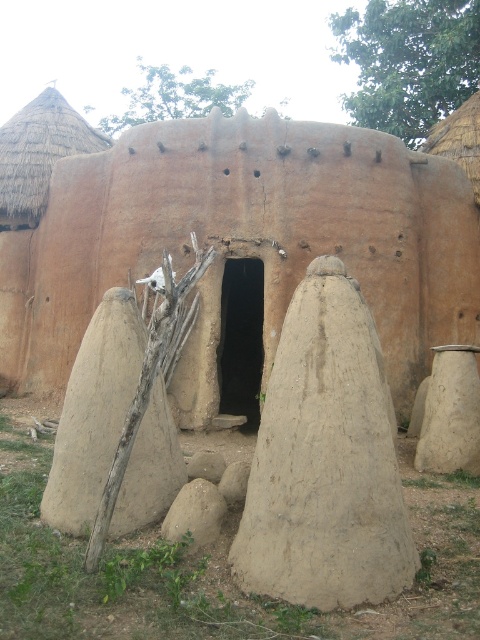
You are standing outside the traditional mud structure and want to place a new decoration. If you want to place it above the beige clay pot at center, where should you place it in relation to the thatched straw roof at upper left?

You should place the decoration above the beige clay pot at center below the thatched straw roof at upper left since the beige clay pot at center is located below thatched straw roof at upper left.

Consider the image. You are a traveler carrying a small backpack and need to place your backpack on a flat surface. You see a brown clay pot at right and a brown rough stone at center. Which object can you use to place your backpack?

The brown rough stone at center is a flat surface, so you can place your backpack there.